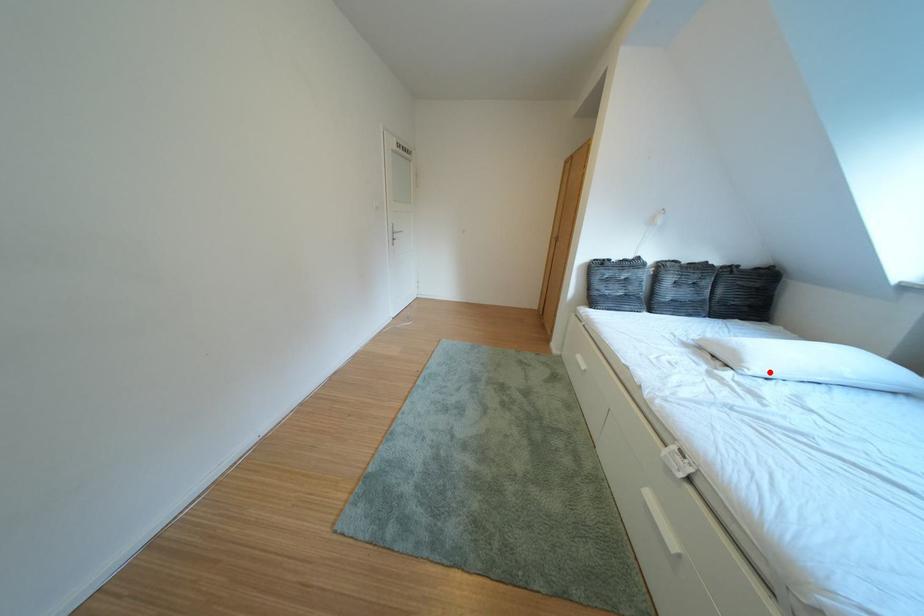
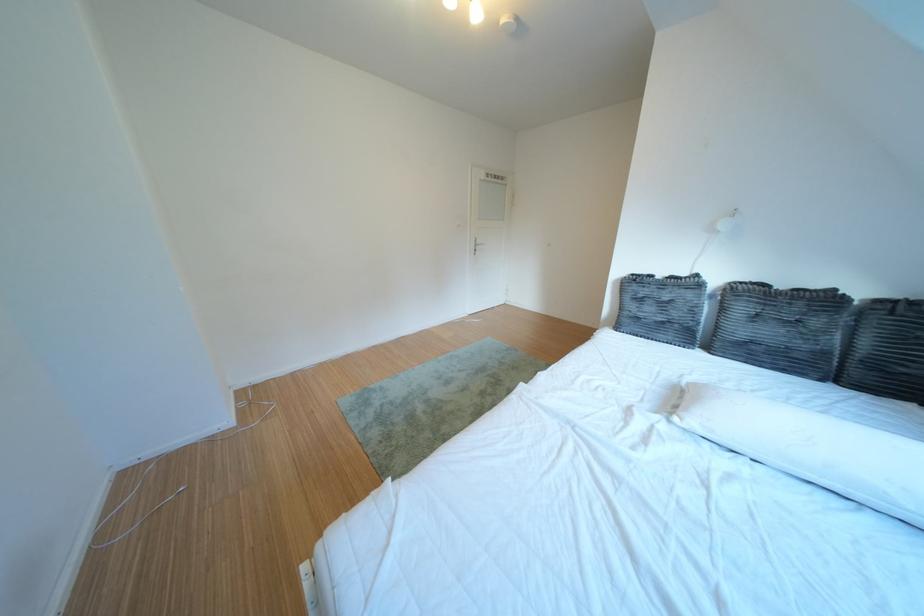
Locate, in the second image, the point that corresponds to the highlighted location in the first image.

(707, 424)